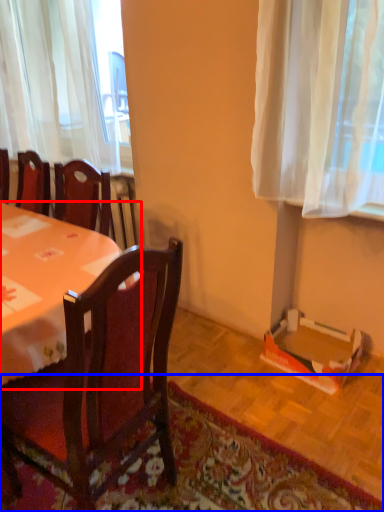
Question: Which object appears closest to the camera in this image, desk (highlighted by a red box) or mat (highlighted by a blue box)?

Choices:
 (A) desk
 (B) mat

Answer: (B)